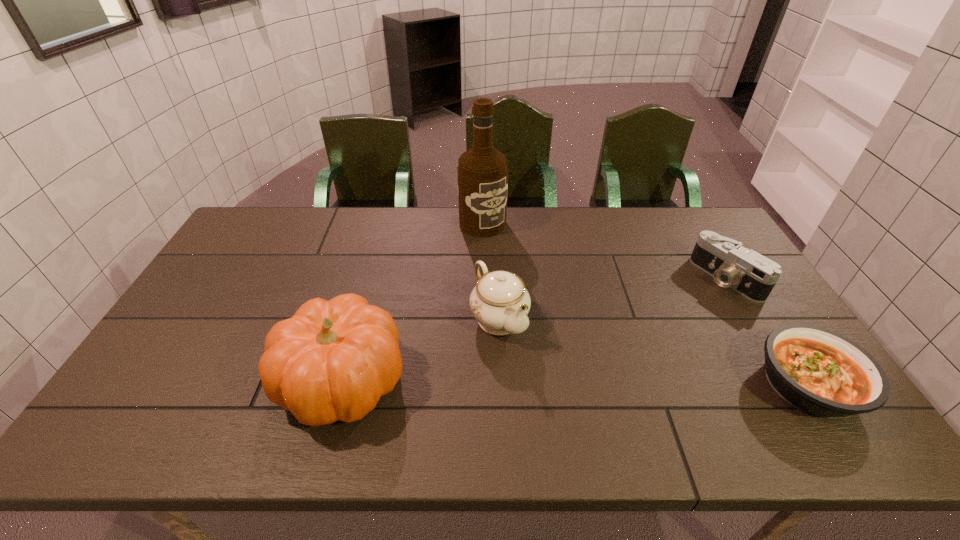
Identify the location of the leftmost object. (332, 360).

Identify the location of pumpkin. Image resolution: width=960 pixels, height=540 pixels. (332, 360).

Image resolution: width=960 pixels, height=540 pixels. Identify the location of stew. (818, 371).

What are the coordinates of `the tallest object` in the screenshot? It's located at (482, 171).

This screenshot has height=540, width=960. Identify the location of the farthest object. (482, 171).

Image resolution: width=960 pixels, height=540 pixels. I want to click on the second shortest object, so click(752, 275).

In order to click on the third tallest object in this screenshot , I will do `click(500, 302)`.

The width and height of the screenshot is (960, 540). Find the location of `free space located 0.210m on the right of the pumpkin`. free space located 0.210m on the right of the pumpkin is located at coordinates (492, 381).

Identify the location of free space located on the left of the stew. (611, 385).

This screenshot has height=540, width=960. Find the location of `free space located on the label of the alcohol`. free space located on the label of the alcohol is located at coordinates (534, 280).